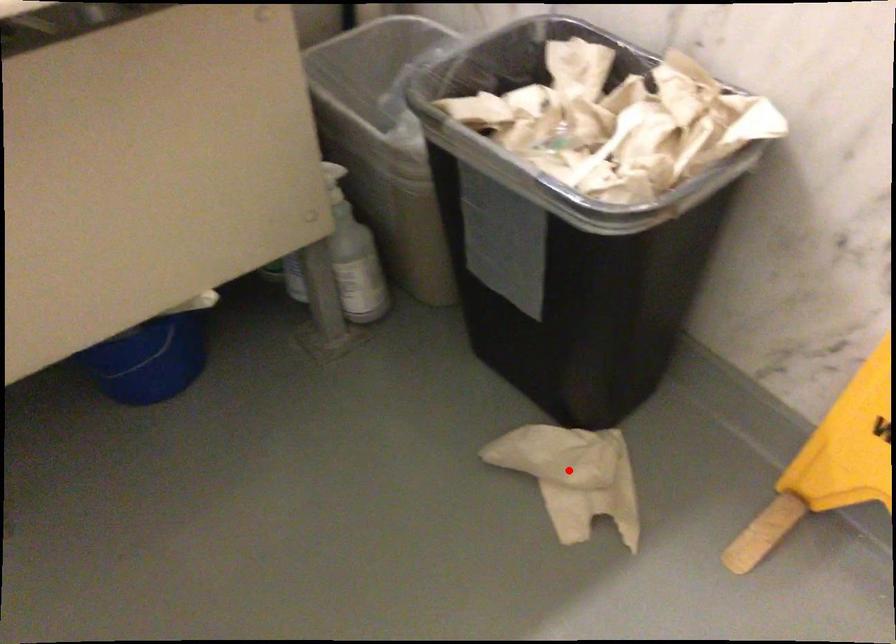
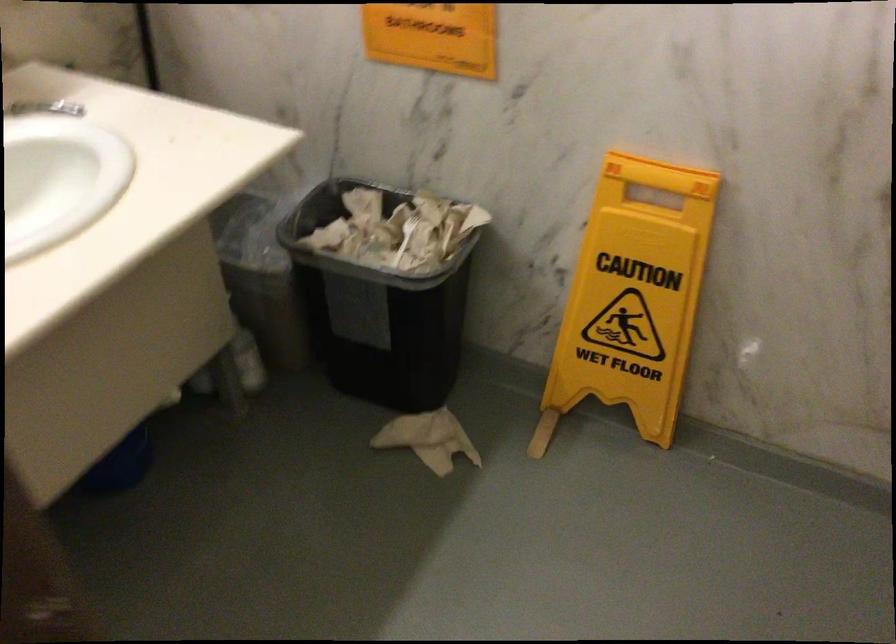
Where in the second image is the point corresponding to the highlighted location from the first image?

(428, 439)